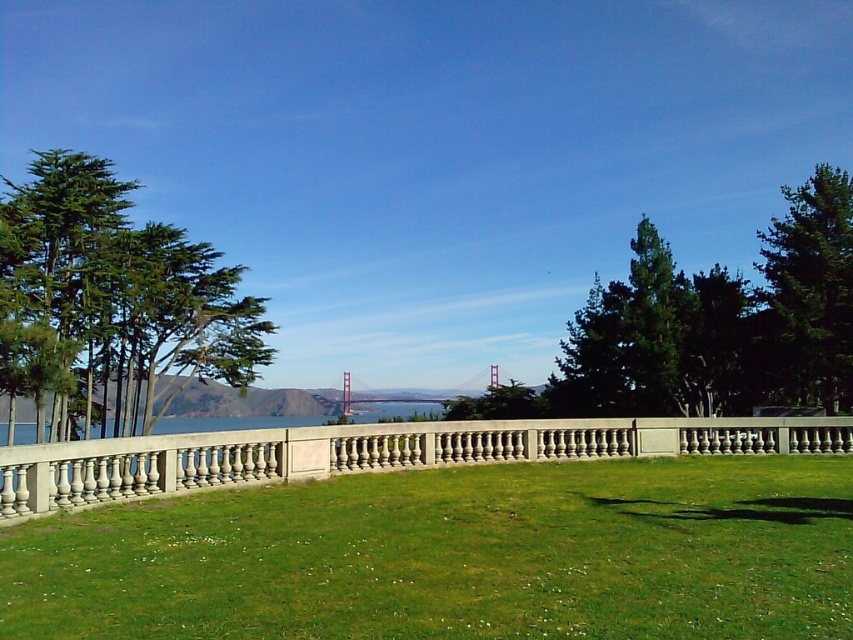
Question: Is green needle-like foliage at left above metallic bridge at center?

Choices:
 (A) yes
 (B) no

Answer: (A)

Question: Among these points, which one is farthest from the camera?

Choices:
 (A) (791, 230)
 (B) (361, 397)

Answer: (B)

Question: Estimate the real-world distances between objects in this image. Which object is closer to the green textured tree at right?

Choices:
 (A) smooth concrete fence at center
 (B) metallic bridge at center
 (C) green needle-like foliage at left

Answer: (A)

Question: Does smooth concrete fence at center appear on the right side of metallic bridge at center?

Choices:
 (A) no
 (B) yes

Answer: (B)

Question: Does green needle-like foliage at left have a greater width compared to smooth concrete fence at center?

Choices:
 (A) no
 (B) yes

Answer: (B)

Question: Which object is farther from the camera taking this photo?

Choices:
 (A) smooth concrete fence at center
 (B) green grass at center

Answer: (A)